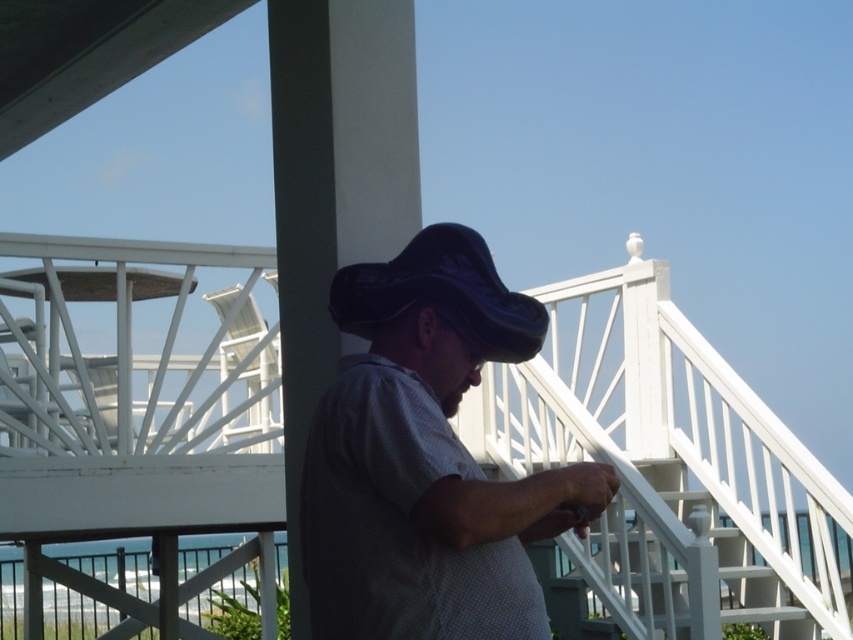
Does matte black hat at center have a lesser height compared to black leather hat at center?

Incorrect, matte black hat at center's height does not fall short of black leather hat at center's.

Which is behind, point (471, 504) or point (518, 300)?

The point (518, 300) is more distant.

Where is `matte black hat at center`? matte black hat at center is located at coordinates (427, 458).

Which is below, white wooden porch at center or black leather hat at center?

white wooden porch at center is below.

Is white wooden porch at center closer to the viewer compared to black leather hat at center?

Yes, it is in front of black leather hat at center.

Does point (813, 484) lie behind point (440, 234)?

Yes, it is.

This screenshot has height=640, width=853. I want to click on white wooden porch at center, so click(619, 476).

Between white wooden porch at center and matte black hat at center, which one is positioned lower?

white wooden porch at center

Is point (252, 451) closer to viewer compared to point (532, 576)?

No, (252, 451) is further to viewer.

Who is more forward, (41, 598) or (509, 324)?

Point (509, 324) is more forward.

The image size is (853, 640). I want to click on white wooden porch at center, so click(619, 476).